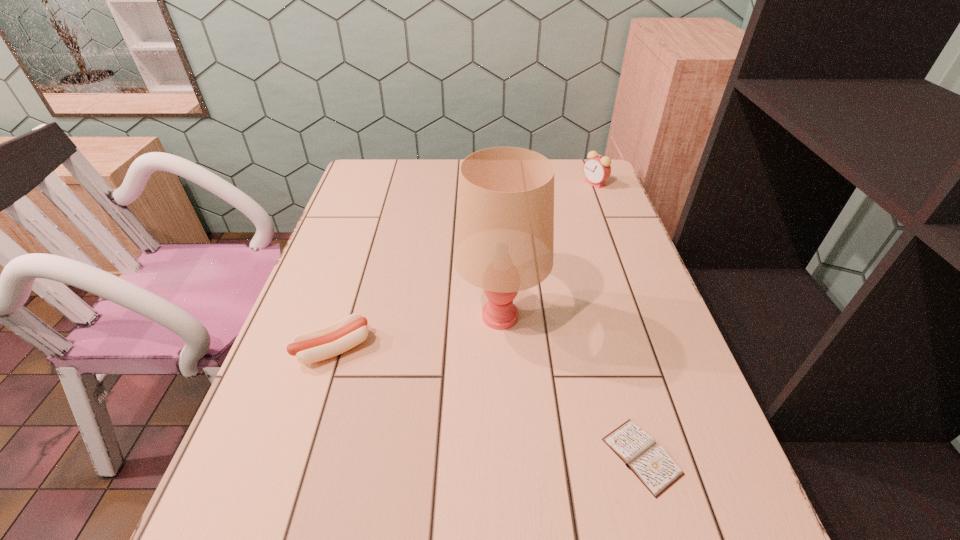
Find the location of a particular element. This screenshot has height=540, width=960. vacant space at the left edge of the desktop is located at coordinates (381, 208).

Where is `vacant space at the right edge of the desktop`? Image resolution: width=960 pixels, height=540 pixels. vacant space at the right edge of the desktop is located at coordinates (671, 349).

This screenshot has height=540, width=960. In order to click on free space at the far right corner of the desktop in this screenshot , I will do tap(573, 166).

The image size is (960, 540). Find the location of `free space that is in between the third object from right to left and the leftmost object`. free space that is in between the third object from right to left and the leftmost object is located at coordinates (418, 332).

Where is `empty space between the shortest object and the lampshade`? The width and height of the screenshot is (960, 540). empty space between the shortest object and the lampshade is located at coordinates (571, 386).

What are the coordinates of `free spot between the second object from left to right and the third tallest object` in the screenshot? It's located at (418, 332).

Image resolution: width=960 pixels, height=540 pixels. I want to click on free area in between the alarm clock and the diary, so click(x=618, y=320).

You are a GUI agent. You are given a task and a screenshot of the screen. Output one action in this format:
    pyautogui.click(x=<x>, y=<y>)
    Task: Click on the free space between the shortest object and the second shortest object
    This screenshot has width=960, height=540.
    Given the screenshot: What is the action you would take?
    pyautogui.click(x=488, y=402)

Locate an element on the screen. This screenshot has height=540, width=960. empty space between the leftmost object and the lampshade is located at coordinates (418, 332).

Locate an element on the screen. free space between the leftmost object and the tallest object is located at coordinates [x=418, y=332].